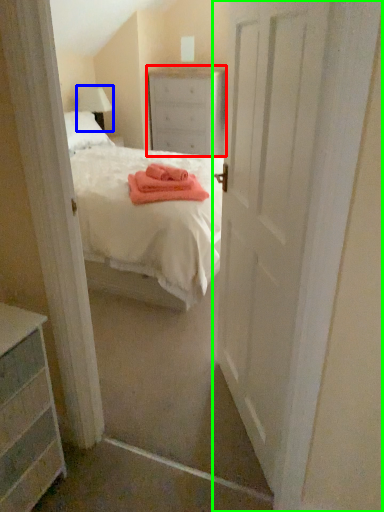
Question: Which object is the closest to the nightstand (highlighted by a red box)? Choose among these: lamp (highlighted by a blue box) or door (highlighted by a green box).

Choices:
 (A) lamp
 (B) door

Answer: (A)